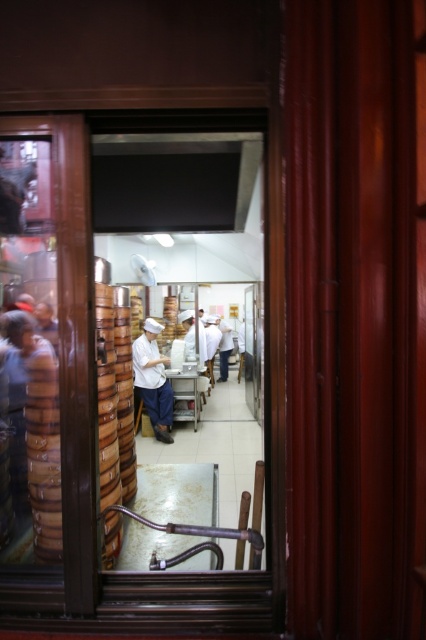
You are standing outside the kitchen and looking through the transparent glass window at center. You notice a white uniform at center inside. Which object is more to your left when viewed from your perspective?

The white uniform at center is more to the left because the transparent glass window at center is positioned on the right side of it.

Consider the image. You are a delivery person standing outside the window. You need to hand over a package to the person wearing the white uniform at center through the transparent glass window at center. Is the window large enough for the package?

The transparent glass window at center is smaller than the white uniform at center. Since the window is smaller than the uniform, it might not be large enough to pass the package through. Check the window size before attempting.

You are a customer looking through the transparent glass window at center to see the kitchen inside. Can you see the white uniform at center of the staff through the window?

The transparent glass window at center is positioned over white uniform at center, so yes, you can see the white uniform at center through the window.